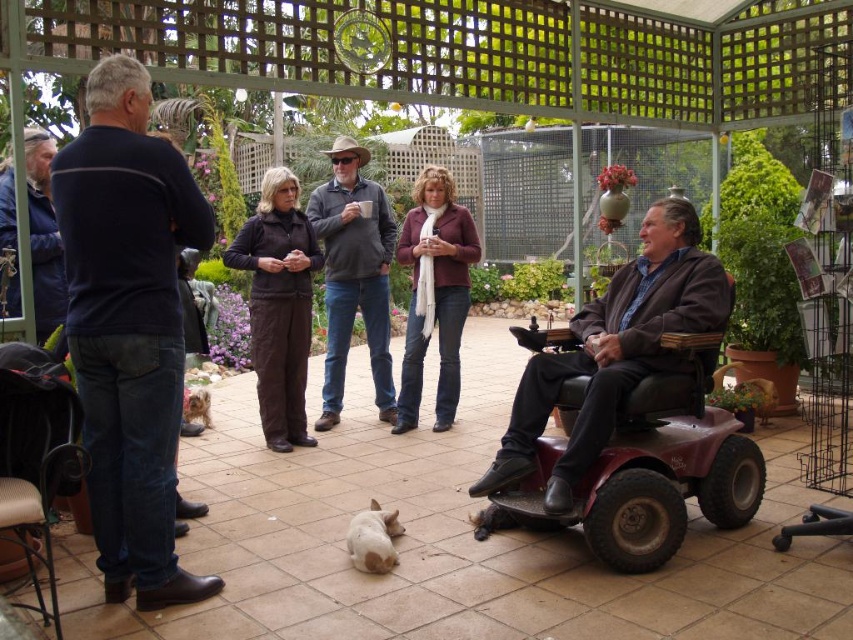
Question: Which is farther from the white fur dog at center?

Choices:
 (A) dark gray sweater at center
 (B) white fluffy dog at lower left
 (C) dark blue sweater at left

Answer: (B)

Question: Which of the following is the farthest from the observer?

Choices:
 (A) white fur dog at center
 (B) dark blue sweater at left
 (C) white fluffy dog at lower left

Answer: (C)

Question: Is dark blue jeans at left closer to camera compared to white fur dog at center?

Choices:
 (A) yes
 (B) no

Answer: (B)

Question: Is dark blue jeans at left bigger than white fluffy dog at lower left?

Choices:
 (A) yes
 (B) no

Answer: (A)

Question: Is dark blue sweater at left smaller than white fluffy dog at lower left?

Choices:
 (A) yes
 (B) no

Answer: (B)

Question: Which point is farther to the camera?

Choices:
 (A) (398, 525)
 (B) (9, 228)

Answer: (B)